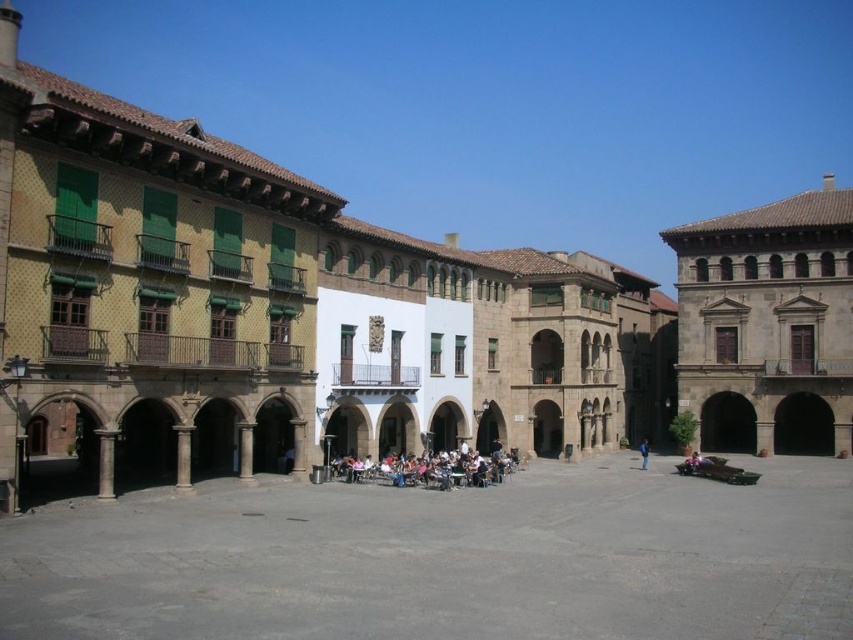
You are standing in the square and want to take a photo of the smooth stone column at left. If your camera can focus on objects up to 50 meters away, will you be able to capture the column clearly?

The smooth stone column at left is 43.17 meters away from the viewer, which is within the camera focus range of 50 meters. Therefore, you can capture the column clearly.

You are standing in the square and want to take a photo of the smooth stone column at left and the white stone pillar at center. Which one should you focus on first if you want to capture both in one frame without moving the camera?

You should focus on the smooth stone column at left first because it is positioned over the white stone pillar at center, meaning it is closer to the camera. By focusing on the closer object, both will be in focus if within the depth of field.

You are standing in the square and want to take a photo of both the smooth stone column at left and the white stone pillar at center. Which object should you position closer to the camera to include both in the frame without cropping?

To include both the smooth stone column at left and the white stone pillar at center in the frame without cropping, you should position the smooth stone column at left closer to the camera since it is shorter than the white stone pillar at center.